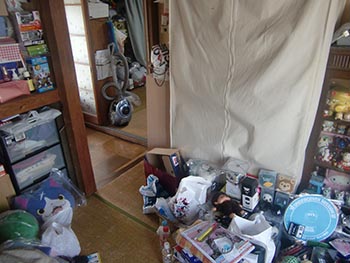
You are a GUI agent. You are given a task and a screenshot of the screen. Output one action in this format:
    pyautogui.click(x=<x>, y=<y>)
    Task: Click on the things in the closet
    The height and width of the screenshot is (263, 350).
    Given the screenshot: What is the action you would take?
    pyautogui.click(x=38, y=51), pyautogui.click(x=34, y=45), pyautogui.click(x=29, y=25)